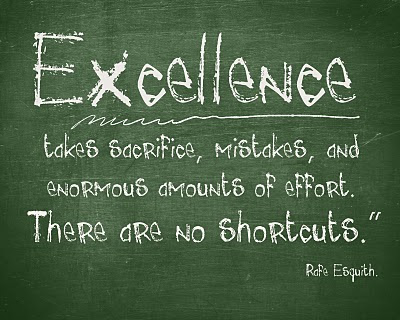
What are the coordinates of `green wall` in the screenshot? It's located at (98, 17), (309, 8), (84, 287), (310, 294).